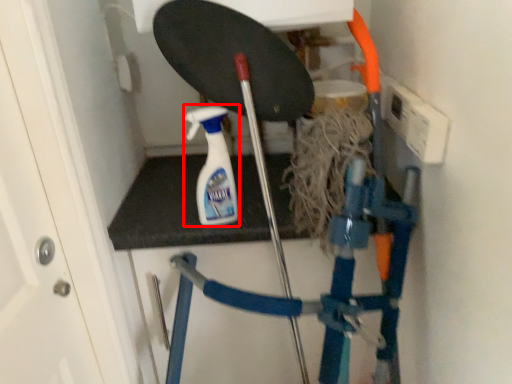
Question: From the image, what is the correct spatial relationship of cleaning product (annotated by the red box) in relation to ladder?

Choices:
 (A) left
 (B) right

Answer: (A)